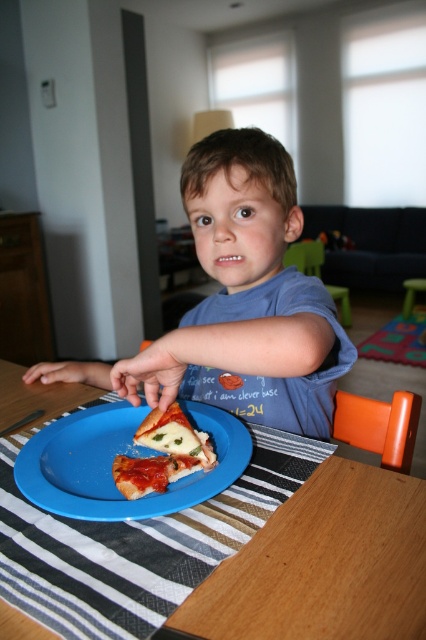
Question: Can you confirm if wooden table at center is bigger than golden brown crusty pizza at center?

Choices:
 (A) no
 (B) yes

Answer: (B)

Question: Can you confirm if wooden table at center is bigger than golden brown crusty pizza at center?

Choices:
 (A) no
 (B) yes

Answer: (B)

Question: Which is nearer to the wooden table at center?

Choices:
 (A) blue cotton shirt at center
 (B) golden brown crusty pizza at center
 (C) blue plastic plate at center

Answer: (C)

Question: Which point is closer to the camera taking this photo?

Choices:
 (A) (187, 472)
 (B) (333, 394)
 (C) (356, 561)

Answer: (C)

Question: Is wooden table at center further to camera compared to golden brown crusty pizza at center?

Choices:
 (A) no
 (B) yes

Answer: (A)

Question: Which object is the farthest from the golden brown crusty pizza at center?

Choices:
 (A) wooden table at center
 (B) blue cotton shirt at center
 (C) blue plastic plate at center

Answer: (B)